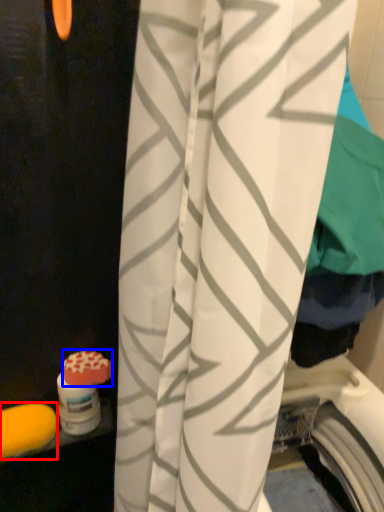
Question: Which object is closer to the camera taking this photo, soap (highlighted by a red box) or soap (highlighted by a blue box)?

Choices:
 (A) soap
 (B) soap

Answer: (A)